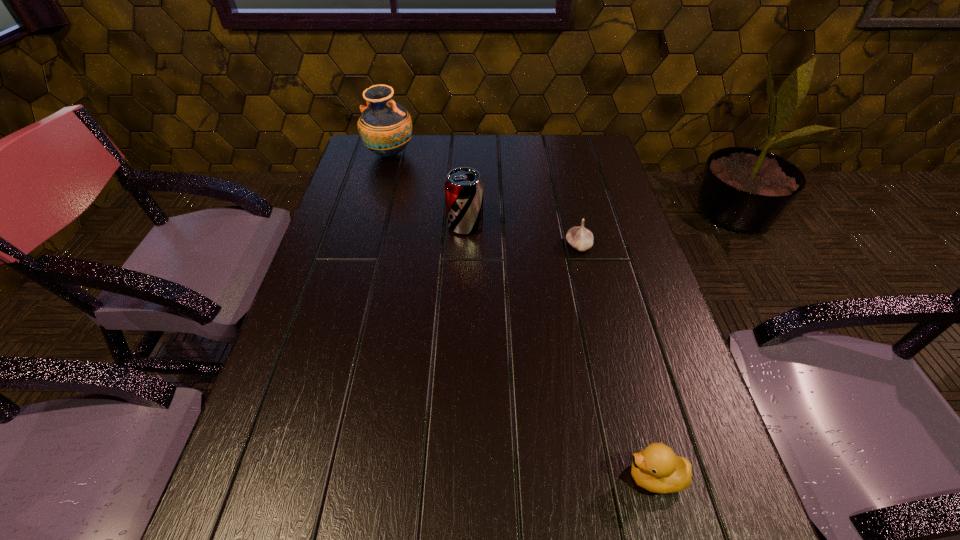
Identify the location of free spot between the duckling and the soda can. This screenshot has height=540, width=960. (560, 351).

Locate an element on the screen. Image resolution: width=960 pixels, height=540 pixels. unoccupied position between the second object from left to right and the duckling is located at coordinates (560, 351).

Where is `free space between the nearest object and the garlic`? The image size is (960, 540). free space between the nearest object and the garlic is located at coordinates (616, 361).

Identify the location of empty space that is in between the garlic and the second object from left to right. (522, 235).

Image resolution: width=960 pixels, height=540 pixels. Identify the location of free space between the third shortest object and the duckling. point(560,351).

Where is `unoccupied position between the garlic and the farthest object`? The height and width of the screenshot is (540, 960). unoccupied position between the garlic and the farthest object is located at coordinates (484, 200).

In order to click on free space between the second tallest object and the farthest object in this screenshot , I will do `click(427, 190)`.

At what (x,y) coordinates should I click in order to perform the action: click on vacant area between the duckling and the garlic. Please return your answer as a coordinate pair (x, y). The width and height of the screenshot is (960, 540). Looking at the image, I should click on (616, 361).

The height and width of the screenshot is (540, 960). I want to click on free space between the garlic and the nearest object, so click(x=616, y=361).

Find the location of a particular element. The image size is (960, 540). vacant space in between the nearest object and the second object from left to right is located at coordinates (560, 351).